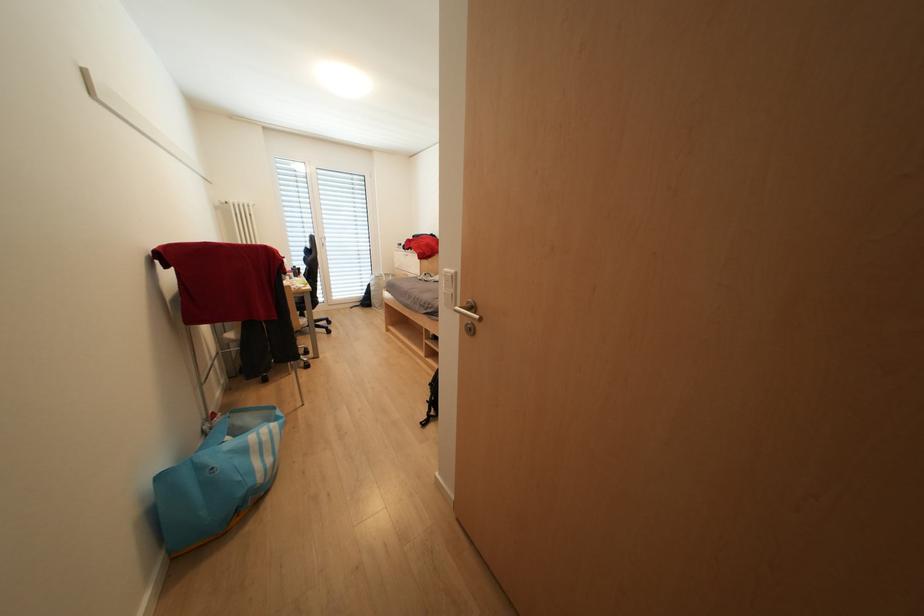
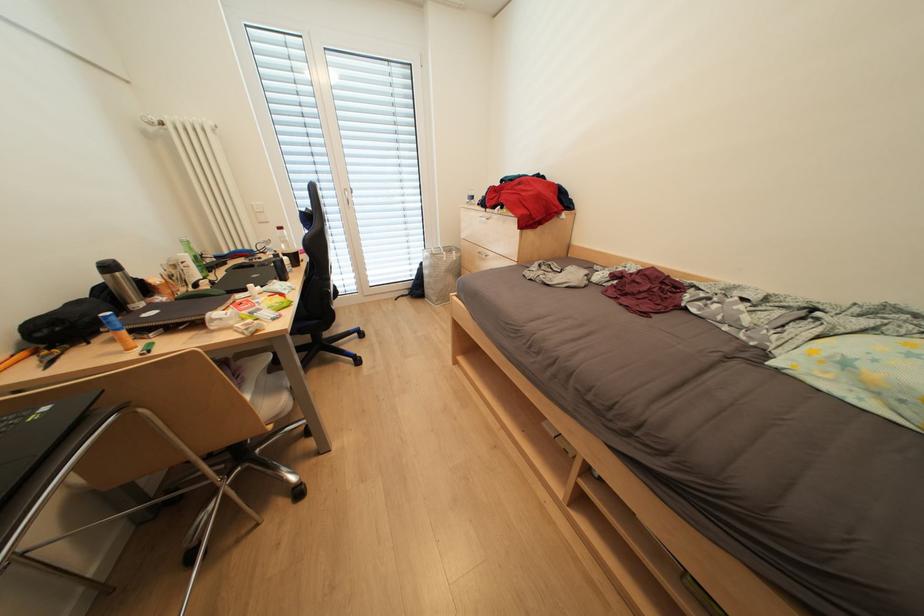
Which direction would the cameraman need to move to produce the second image?

The cameraman walked toward left, forward.